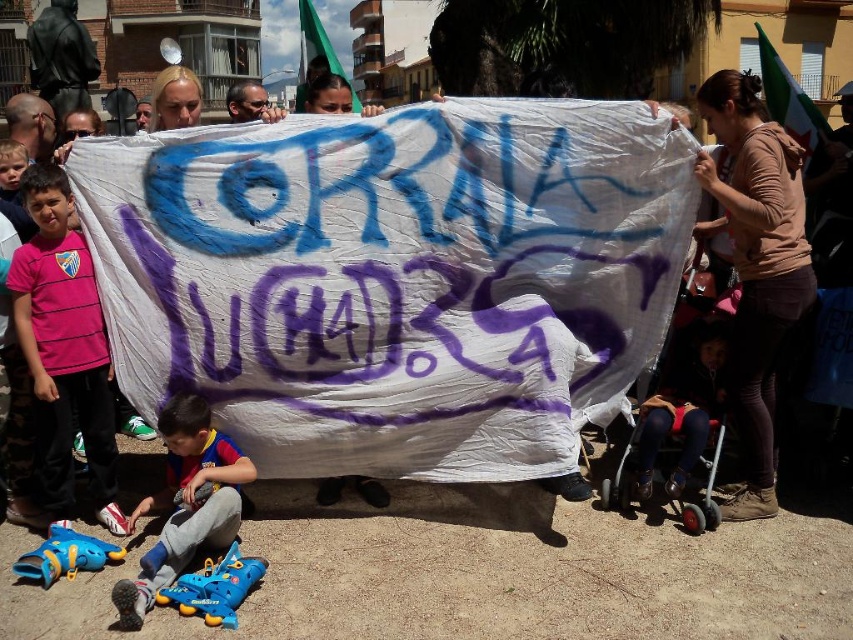
Based on the photo, does pink fabric shirt at left have a smaller size compared to dark blue denim pants at lower right?

No, pink fabric shirt at left is not smaller than dark blue denim pants at lower right.

Which is more to the right, pink fabric shirt at left or dark blue denim pants at lower right?

Positioned to the right is dark blue denim pants at lower right.

At what (x,y) coordinates should I click in order to perform the action: click on pink fabric shirt at left. Please return your answer as a coordinate pair (x, y). Image resolution: width=853 pixels, height=640 pixels. Looking at the image, I should click on (64, 348).

Can you confirm if blue rubber roller skates at lower left is bigger than dark blue denim pants at lower right?

Yes, blue rubber roller skates at lower left is bigger than dark blue denim pants at lower right.

Is blue rubber roller skates at lower left smaller than dark blue denim pants at lower right?

No, blue rubber roller skates at lower left is not smaller than dark blue denim pants at lower right.

Between point (202, 465) and point (666, 413), which one is positioned in front?

Point (202, 465) is more forward.

This screenshot has width=853, height=640. What are the coordinates of `blue rubber roller skates at lower left` in the screenshot? It's located at (184, 502).

Which is below, pink fabric shirt at left or blue rubber roller skates at lower left?

Positioned lower is blue rubber roller skates at lower left.

Is pink fabric shirt at left to the right of blue rubber roller skates at lower left from the viewer's perspective?

No, pink fabric shirt at left is not to the right of blue rubber roller skates at lower left.

Identify the location of pink fabric shirt at left. (64, 348).